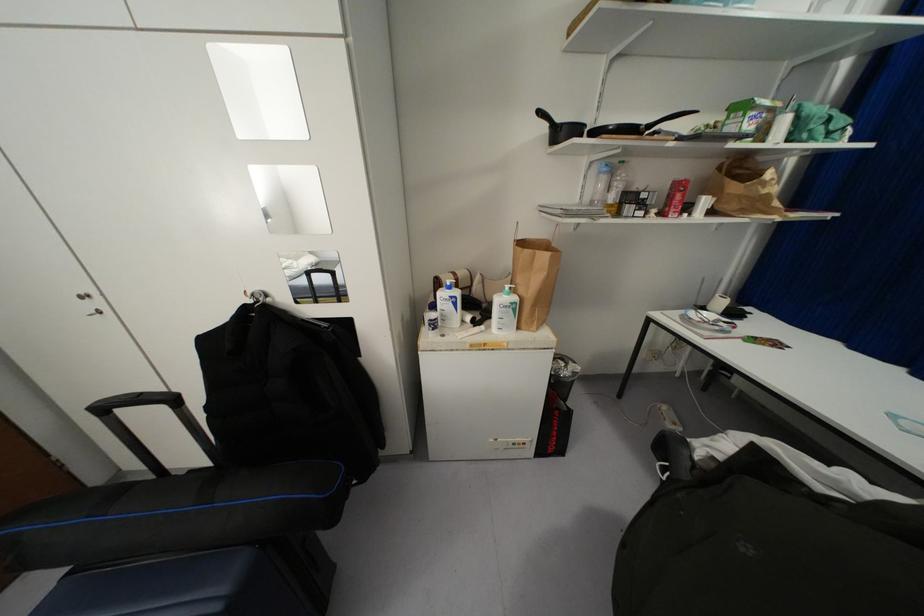
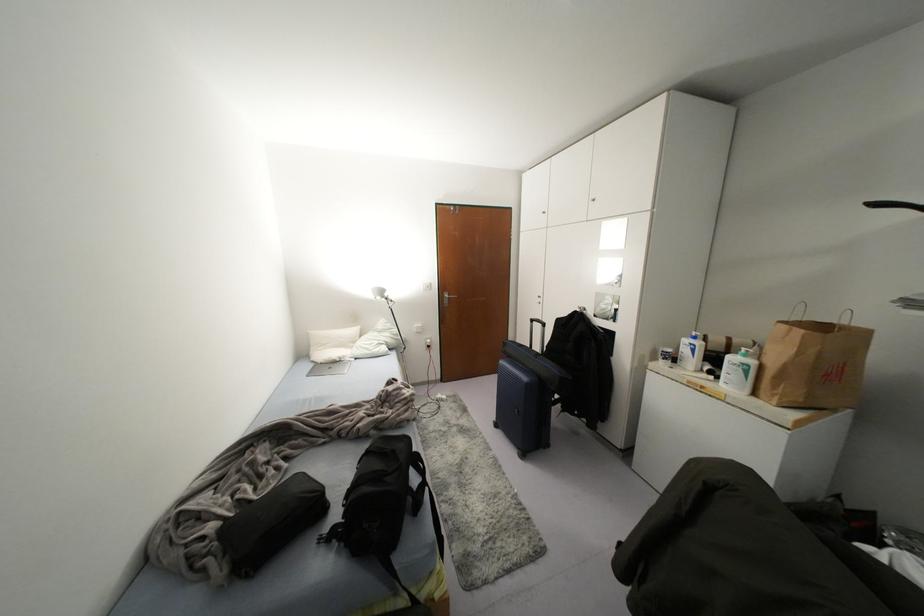
The point at (515, 298) is marked in the first image. Where is the corresponding point in the second image?

(751, 362)